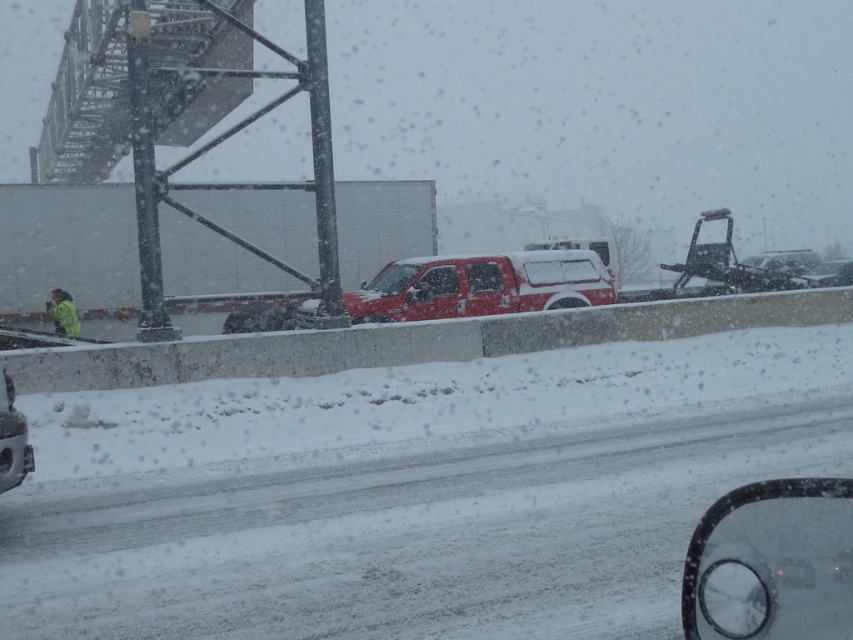
You are a driver navigating a snowy highway and see two points marked in the scene. Which point is closer to your windshield? The points are point (537, 308) and point (27, 435).

Point (27, 435) is closer to the windshield because it is nearer to the camera compared to point (537, 308), which is further away.

You are driving a delivery van that is 2.2 meters wide. You need to pass through a narrow tunnel that allows vehicles up to 2.3 meters wide. There are two vehicles ahead of you in the image. Based on the information provided, can you determine if either the matte red pickup truck at center or the shiny black car at lower left would block your path if you attempt to enter the tunnel?

The matte red pickup truck at center might be wider than shiny black car at lower left. Since your delivery van is 2.2 meters wide and the tunnel allows up to 2.3 meters, the shiny black car at lower left is likely narrow enough. However, the matte red pickup truck at center might exceed the limit, potentially blocking your path if it is wider than 2.3 meters. Check the truck first before proceeding.

You are driving a car and see the matte red pickup truck at center and the shiny black car at lower left on the road. Which vehicle would appear taller to you from your current position?

The matte red pickup truck at center is much taller than the shiny black car at lower left, so it would appear taller from your current position.